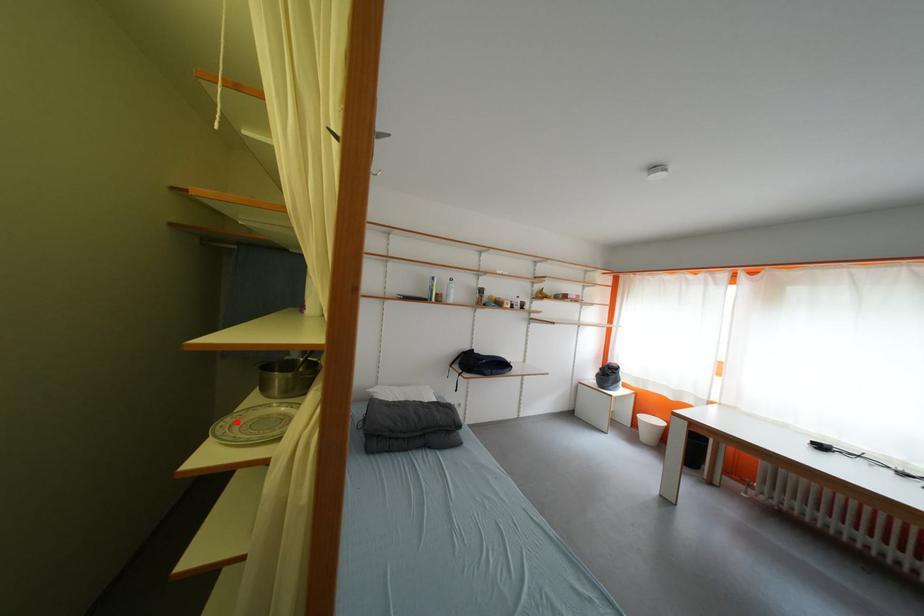
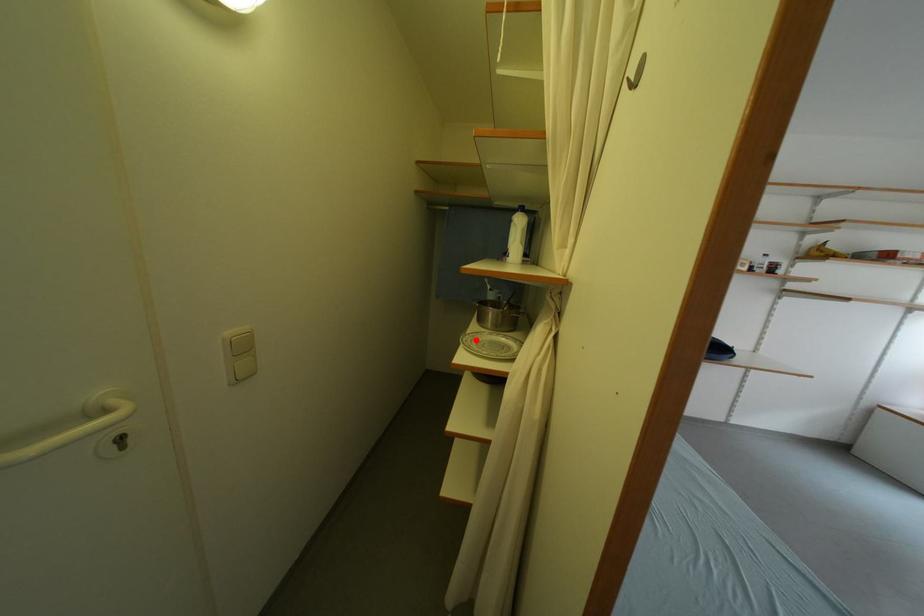
I am providing you with two images of the same scene from different viewpoints. A red point is marked on the first image and another point is marked on the second image. Do the highlighted points in image1 and image2 indicate the same real-world spot?

Yes